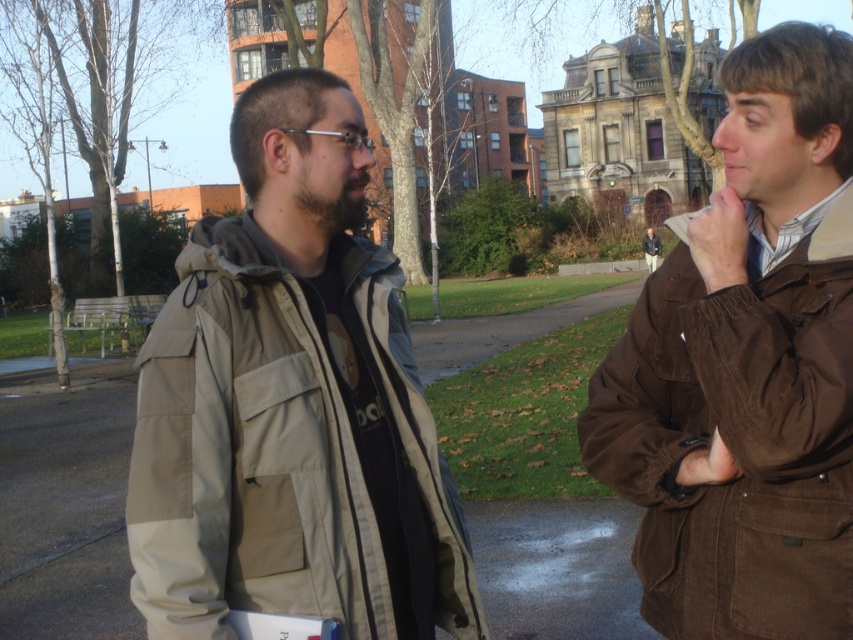
Question: Does khaki fabric jacket at left have a smaller size compared to brown corduroy jacket at right?

Choices:
 (A) no
 (B) yes

Answer: (A)

Question: Does khaki fabric jacket at left have a lesser width compared to brown corduroy jacket at right?

Choices:
 (A) yes
 (B) no

Answer: (B)

Question: Among these points, which one is farthest from the camera?

Choices:
 (A) (410, 493)
 (B) (775, 529)

Answer: (A)

Question: Which point appears closest to the camera in this image?

Choices:
 (A) (292, 502)
 (B) (766, 268)

Answer: (A)

Question: Where is khaki fabric jacket at left located in relation to brown corduroy jacket at right in the image?

Choices:
 (A) left
 (B) right

Answer: (A)